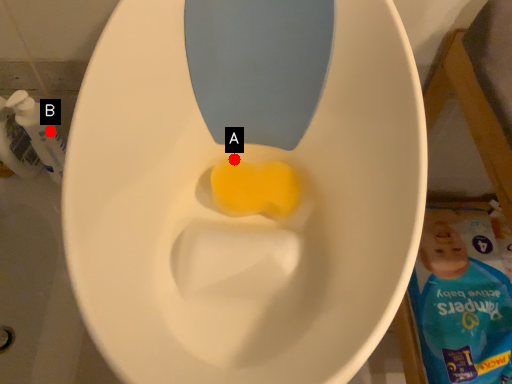
Question: Two points are circled on the image, labeled by A and B beside each circle. Which of the following is the farthest from the observer?

Choices:
 (A) A is further
 (B) B is further

Answer: (B)